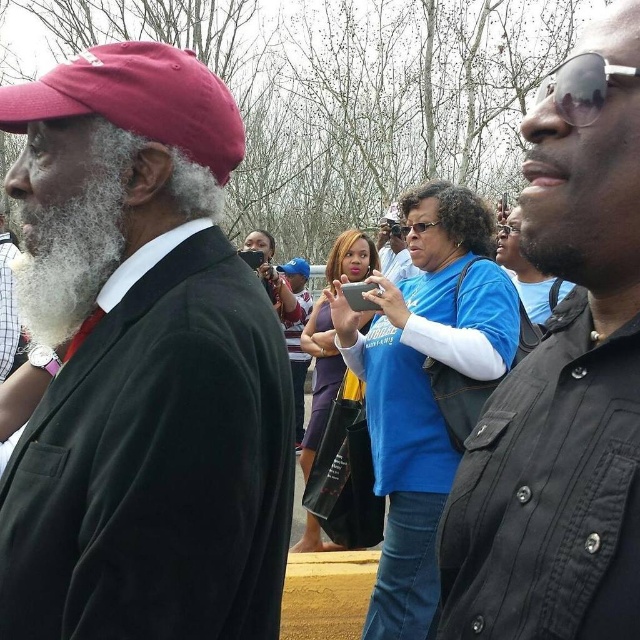
Question: Is black matte shirt at right smaller than black plastic sunglasses at center?

Choices:
 (A) no
 (B) yes

Answer: (B)

Question: Which of these objects is positioned closest to the blue fabric shirt at center?

Choices:
 (A) black plastic sunglasses at center
 (B) matte red cap at left
 (C) blue fabric baseball cap at center

Answer: (A)

Question: Where is black matte shirt at right located in relation to matte black shirt at right in the image?

Choices:
 (A) right
 (B) left

Answer: (B)

Question: Among these points, which one is nearest to the camera?

Choices:
 (A) (592, 118)
 (B) (602, 72)
 (C) (136, 394)
 (D) (422, 228)

Answer: (B)

Question: Among these objects, which one is nearest to the camera?

Choices:
 (A) matte red cap at left
 (B) black plastic sunglasses at center

Answer: (A)

Question: Does matte black shirt at right have a greater width compared to blue fabric baseball cap at center?

Choices:
 (A) yes
 (B) no

Answer: (A)